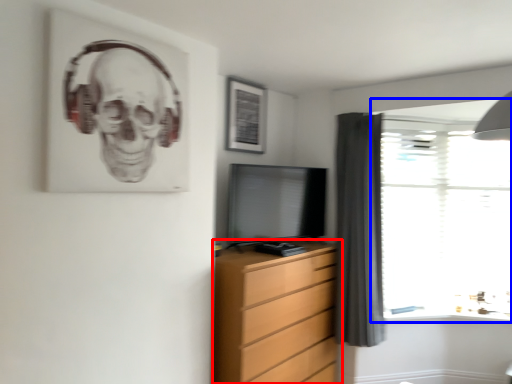
Question: Which of the following is the closest to the observer, chest of drawers (highlighted by a red box) or window (highlighted by a blue box)?

Choices:
 (A) chest of drawers
 (B) window

Answer: (A)